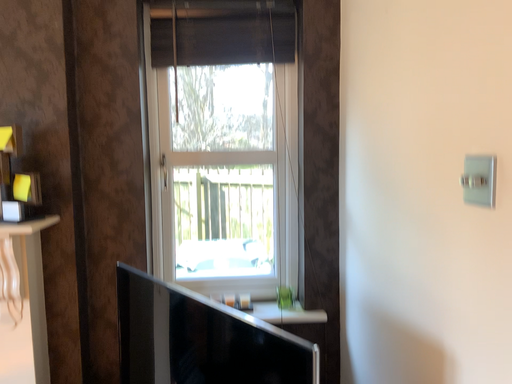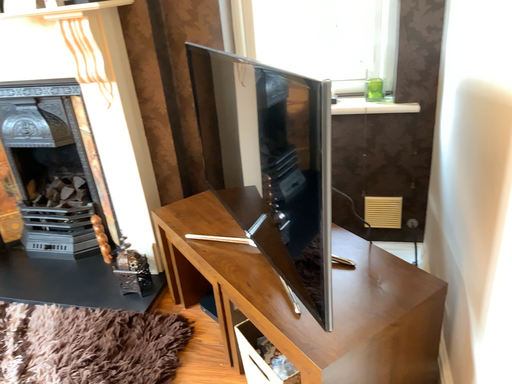
Question: How did the camera likely rotate when shooting the video?

Choices:
 (A) rotated left
 (B) rotated right

Answer: (A)